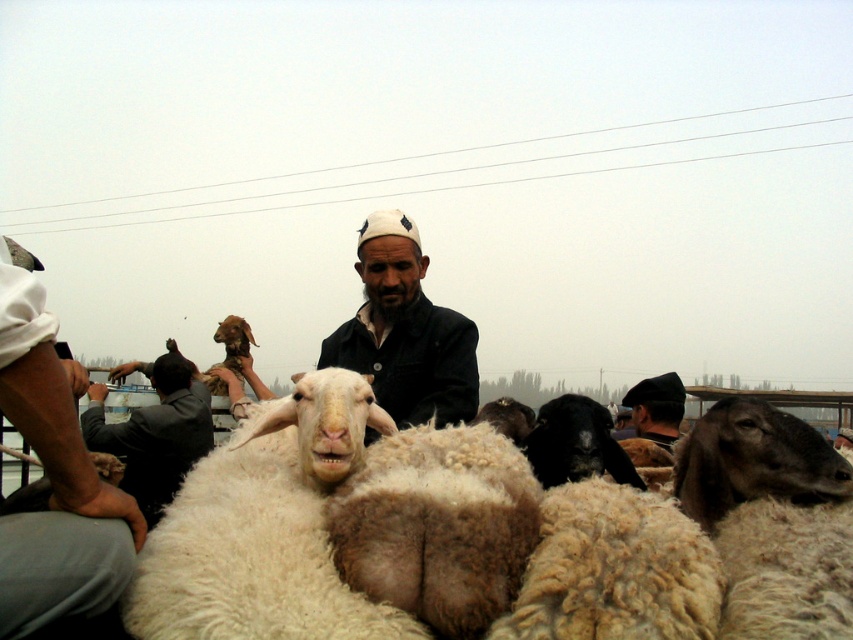
Question: Among these points, which one is farthest from the camera?

Choices:
 (A) (573, 573)
 (B) (543, 472)
 (C) (642, 404)

Answer: (C)

Question: Can you confirm if white woolen sheep at center is positioned above white woolen sheep at lower left?

Choices:
 (A) no
 (B) yes

Answer: (A)

Question: Can you confirm if white woolen sheep at lower left is positioned to the right of black woolen goat at center?

Choices:
 (A) no
 (B) yes

Answer: (A)

Question: From the image, what is the correct spatial relationship of dark blue fabric at center in relation to black woolen goat at center?

Choices:
 (A) right
 (B) left

Answer: (B)

Question: Estimate the real-world distances between objects in this image. Which object is farther from the dark blue fabric at center?

Choices:
 (A) white woolen sheep at lower left
 (B) dark gray woolen hat at right

Answer: (B)

Question: Which object is positioned closest to the white woolen sheep at lower left?

Choices:
 (A) white woolen sheep at center
 (B) gray woolen jacket at left

Answer: (A)